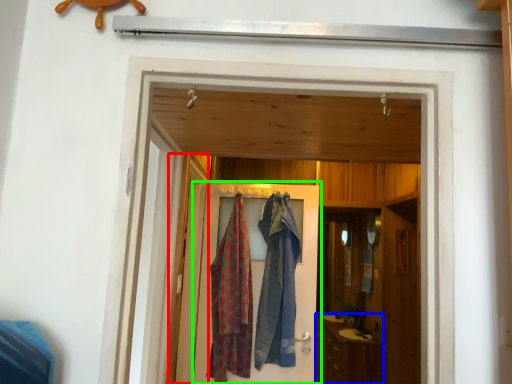
Question: Considering the real-world distances, which object is farthest from screen door (highlighted by a red box)? cabinetry (highlighted by a blue box) or door (highlighted by a green box)?

Choices:
 (A) cabinetry
 (B) door

Answer: (A)